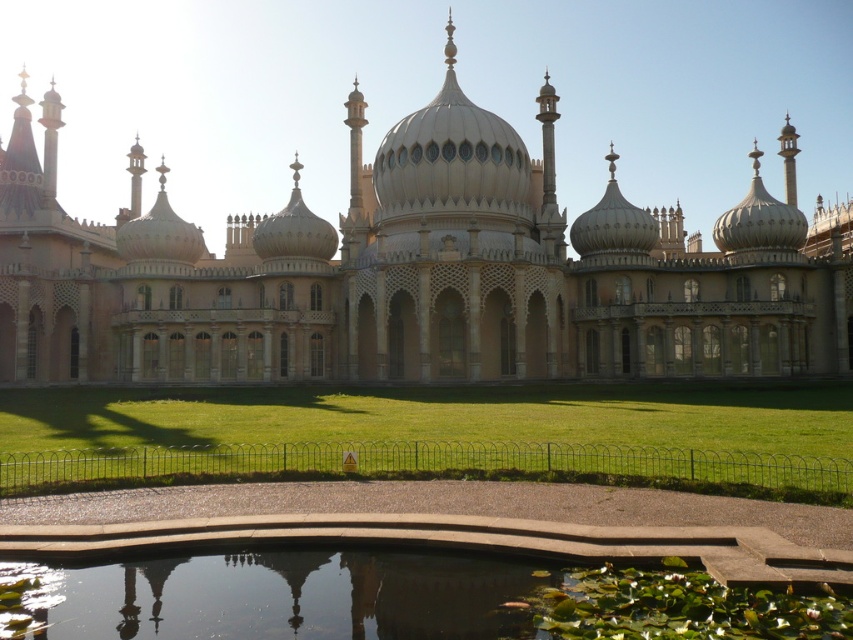
Question: Is beige stone palace at center positioned behind transparent glass pond at center?

Choices:
 (A) yes
 (B) no

Answer: (A)

Question: Which object is closer to the camera taking this photo?

Choices:
 (A) white marble dome at center
 (B) green grass at lower center
 (C) beige stone palace at center
 (D) transparent glass pond at center

Answer: (D)

Question: Does transparent glass pond at center appear over white marble dome at center?

Choices:
 (A) no
 (B) yes

Answer: (A)

Question: Which point is closer to the camera taking this photo?

Choices:
 (A) (399, 208)
 (B) (490, 472)
 (C) (549, 298)

Answer: (B)

Question: Can you confirm if beige stone palace at center is positioned below white marble dome at center?

Choices:
 (A) no
 (B) yes

Answer: (B)

Question: Which of the following is the closest to the observer?

Choices:
 (A) white marble dome at center
 (B) green grass at lower center

Answer: (B)